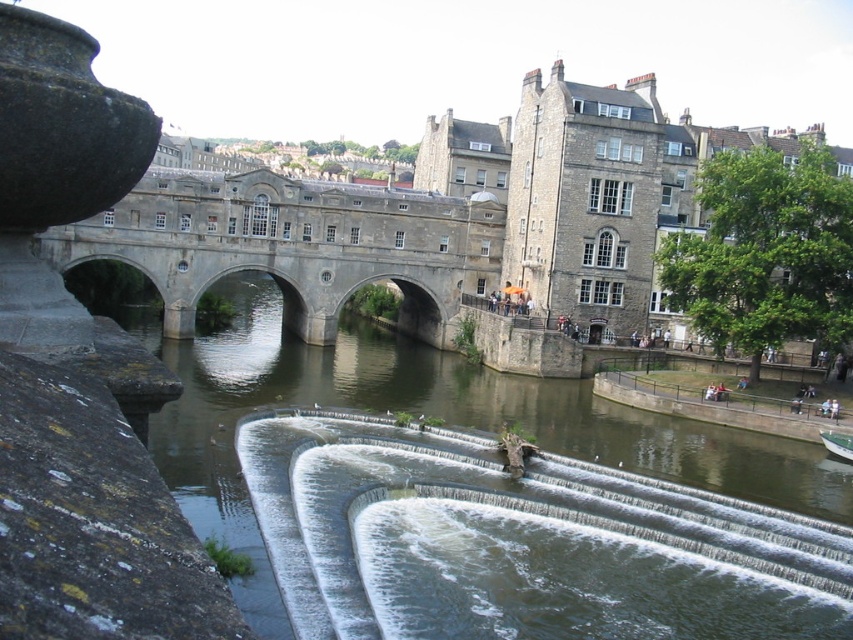
Is greenish-brown stone river at center shorter than stone bridge at center?

Incorrect, greenish-brown stone river at center's height does not fall short of stone bridge at center's.

Is point (363, 356) less distant than point (479, 225)?

Yes, point (363, 356) is in front of point (479, 225).

Who is more forward, (x=643, y=451) or (x=285, y=301)?

Point (x=643, y=451)

In order to click on greenish-brown stone river at center in this screenshot , I will do `click(431, 412)`.

This screenshot has height=640, width=853. Find the location of `greenish-brown stone river at center`. greenish-brown stone river at center is located at coordinates (431, 412).

Between greenish-brown stone river at center and green plastic boat at lower right, which one has less height?

Standing shorter between the two is green plastic boat at lower right.

Which is in front, point (289, 344) or point (839, 449)?

Point (839, 449) is in front.

Identify the location of greenish-brown stone river at center. 431,412.

Who is positioned more to the right, stone bridge at center or green plastic boat at lower right?

green plastic boat at lower right

Looking at this image, does stone bridge at center have a larger size compared to green plastic boat at lower right?

Indeed, stone bridge at center has a larger size compared to green plastic boat at lower right.

What do you see at coordinates (292, 244) in the screenshot?
I see `stone bridge at center` at bounding box center [292, 244].

Identify the location of stone bridge at center. (292, 244).